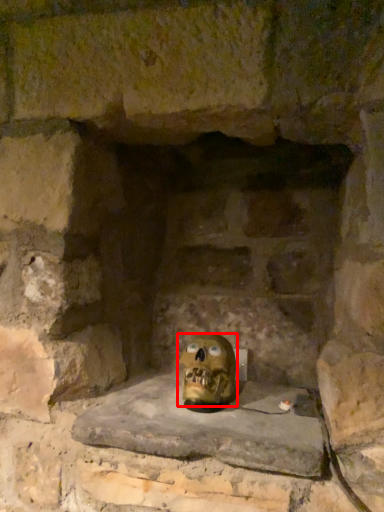
Question: Where is skull (annotated by the red box) located in relation to window sill in the image?

Choices:
 (A) right
 (B) left

Answer: (A)